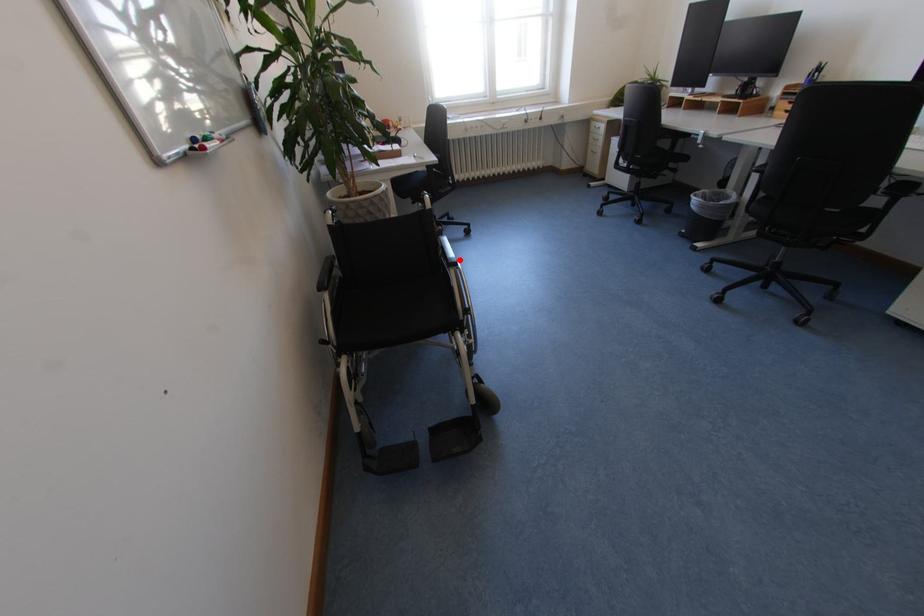
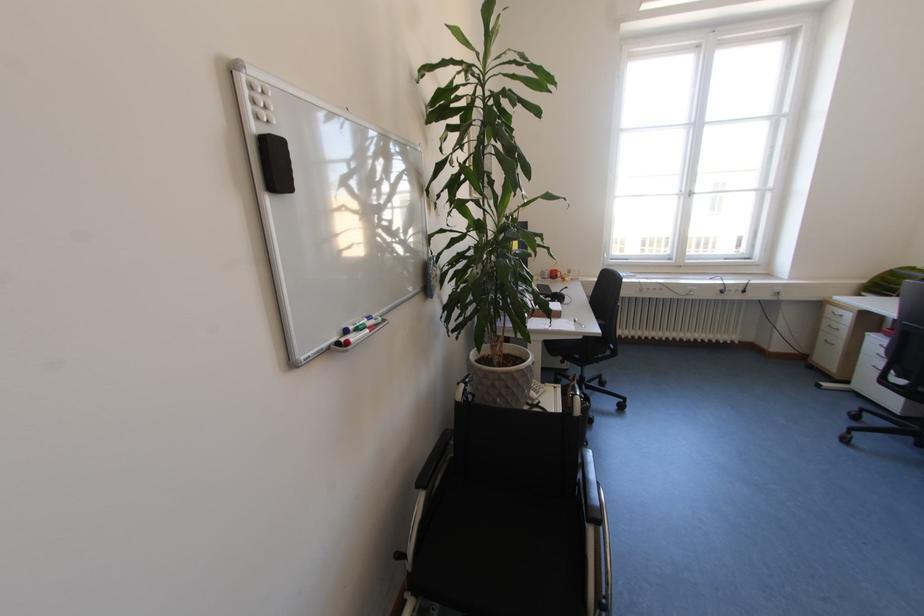
Find the pixel in the second image that matches the highlighted location in the first image.

(602, 508)